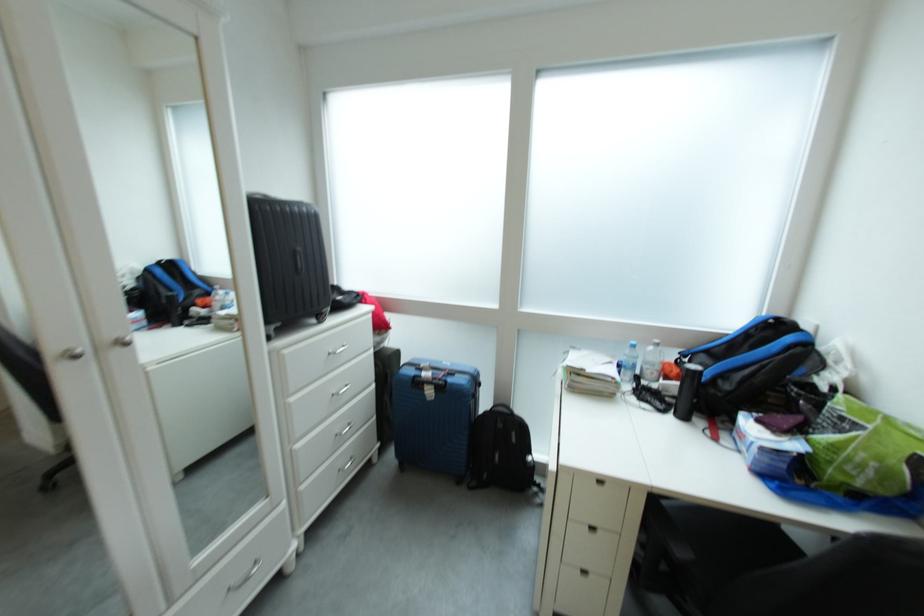
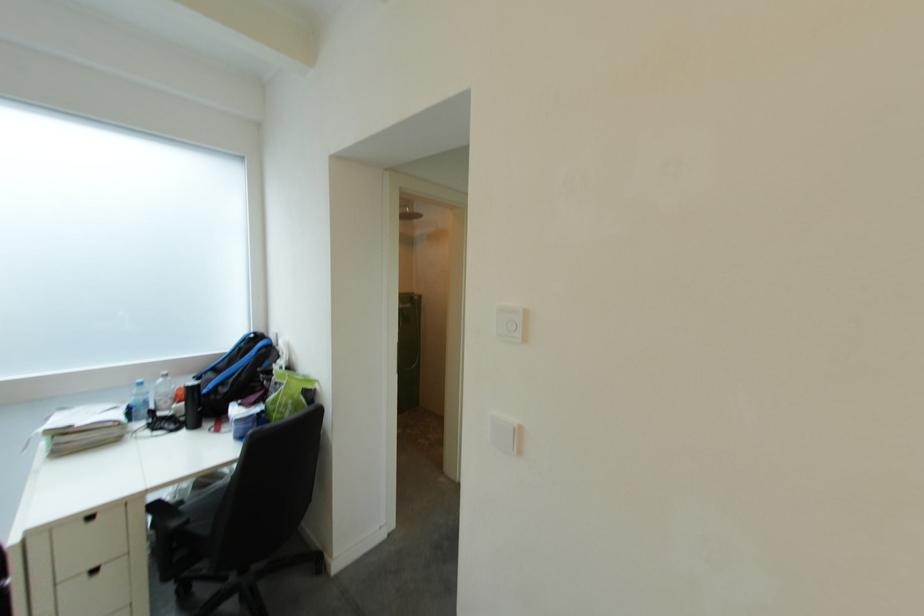
Question: The camera is either moving clockwise (left) or counter-clockwise (right) around the object. The first image is from the beginning of the video and the second image is from the end. Is the camera moving left or right when shooting the video?

Choices:
 (A) Left
 (B) Right

Answer: (A)